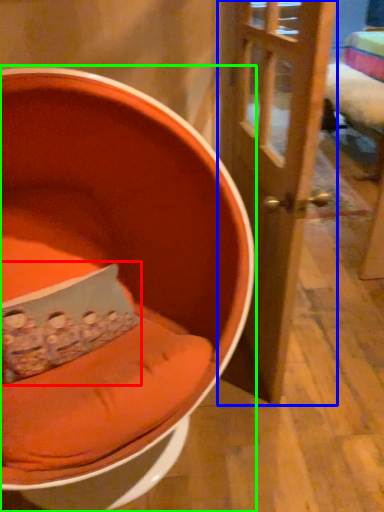
Question: Which object is the farthest from pillow (highlighted by a red box)? Choose among these: door (highlighted by a blue box) or chair (highlighted by a green box).

Choices:
 (A) door
 (B) chair

Answer: (A)